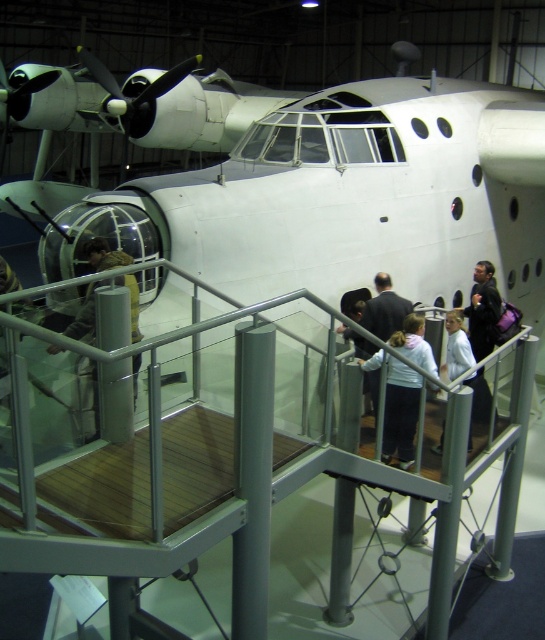
Question: In this image, where is white matte airplane at upper center located relative to white cotton jacket at center?

Choices:
 (A) above
 (B) below

Answer: (A)

Question: Among these points, which one is nearest to the camera?

Choices:
 (A) (390, 400)
 (B) (251, 88)

Answer: (A)

Question: Which is farther from the camouflage fabric jacket at center?

Choices:
 (A) white matte airplane at upper center
 (B) white cotton jacket at center
 (C) dark gray suit at center

Answer: (A)

Question: Can you confirm if camouflage fabric jacket at center is positioned to the right of dark gray suit at center?

Choices:
 (A) no
 (B) yes

Answer: (A)

Question: Which object is the closest to the light gray sweater at right?

Choices:
 (A) dark gray suit at center
 (B) white fleece jacket at center
 (C) camouflage fabric jacket at center
 (D) white matte airplane at upper center

Answer: (A)

Question: Is white matte airplane at upper center to the left of camouflage fabric jacket at center from the viewer's perspective?

Choices:
 (A) no
 (B) yes

Answer: (A)